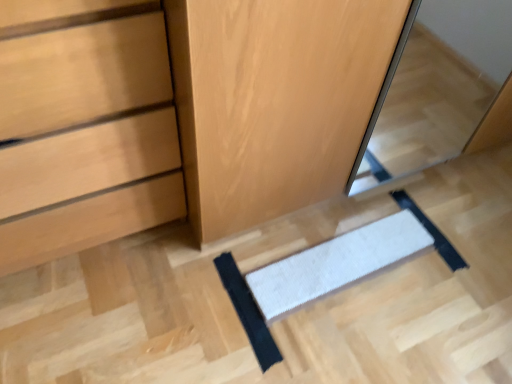
I want to click on empty space that is ontop of white textured mat at center, placed as the 1th doormat when sorted from right to left (from a real-world perspective), so click(x=343, y=259).